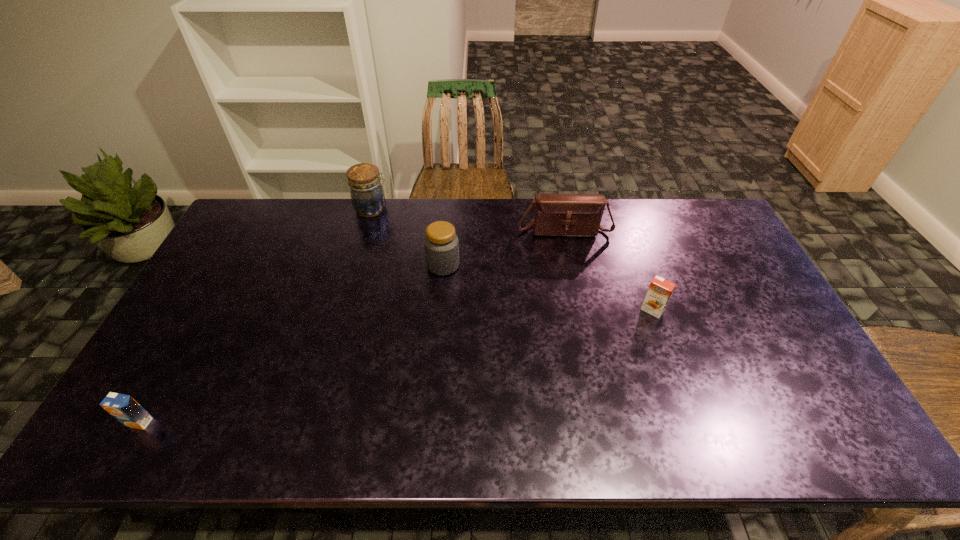
Find the location of `vacant space at the far edge`. vacant space at the far edge is located at coordinates (424, 222).

Identify the location of free space at the near edge of the desktop. (574, 443).

Image resolution: width=960 pixels, height=540 pixels. What are the coordinates of `vacant space at the right edge of the desktop` in the screenshot? It's located at (780, 372).

Where is `free spot at the far right corner of the desktop`? Image resolution: width=960 pixels, height=540 pixels. free spot at the far right corner of the desktop is located at coordinates (675, 200).

You are a GUI agent. You are given a task and a screenshot of the screen. Output one action in this format:
    pyautogui.click(x=<x>, y=<y>)
    Task: Click on the vacant area that lies between the fourth object from right to left and the third farthest object
    Image resolution: width=960 pixels, height=540 pixels.
    Given the screenshot: What is the action you would take?
    pyautogui.click(x=408, y=237)

Find the location of `unoccupied position between the fourth object from right to left and the nearest object`. unoccupied position between the fourth object from right to left and the nearest object is located at coordinates (255, 315).

Image resolution: width=960 pixels, height=540 pixels. In order to click on vacant area between the nearer orange_juice and the third object from left to right in this screenshot , I will do `click(291, 343)`.

Locate an element on the screen. The width and height of the screenshot is (960, 540). vacant space in between the third nearest object and the right orange_juice is located at coordinates (548, 288).

The image size is (960, 540). I want to click on vacant space in between the second farthest object and the nearer orange_juice, so click(351, 326).

This screenshot has height=540, width=960. I want to click on vacant area that lies between the left orange_juice and the right jar, so click(291, 343).